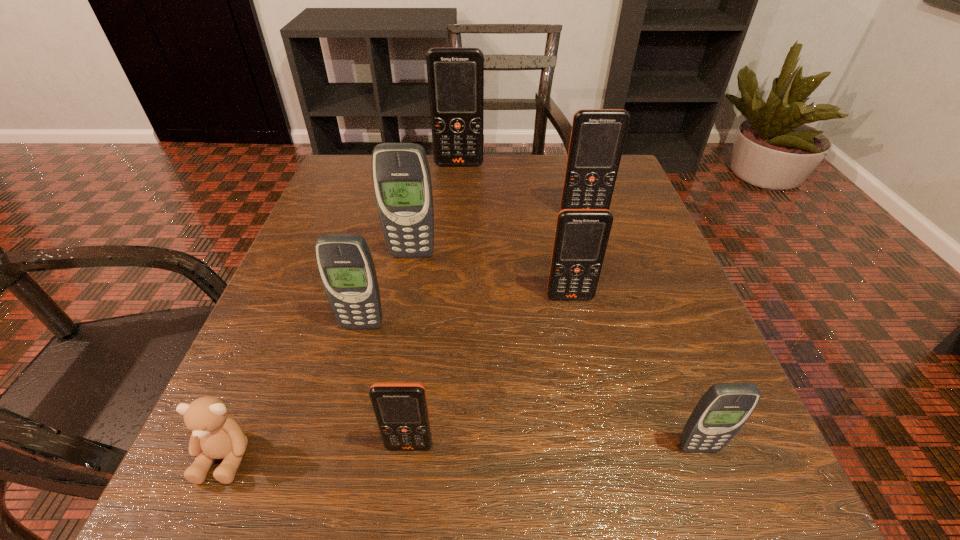
Find the location of `empty location between the farthest cellular telephone and the nearest gray cellular telephone`. empty location between the farthest cellular telephone and the nearest gray cellular telephone is located at coordinates (579, 306).

The image size is (960, 540). Find the location of `empty location between the second biggest gray cellular telephone and the nearest gray cellular telephone`. empty location between the second biggest gray cellular telephone and the nearest gray cellular telephone is located at coordinates (530, 387).

Find the location of a particular element. free space between the rightmost gray cellular telephone and the second biggest gray cellular telephone is located at coordinates (530, 387).

Where is `vacant area that lies between the sixth nearest cellular telephone and the smallest gray cellular telephone`? This screenshot has width=960, height=540. vacant area that lies between the sixth nearest cellular telephone and the smallest gray cellular telephone is located at coordinates (641, 330).

Where is `empty space that is in between the second farthest cellular telephone and the smallest gray cellular telephone`? Image resolution: width=960 pixels, height=540 pixels. empty space that is in between the second farthest cellular telephone and the smallest gray cellular telephone is located at coordinates (641, 330).

Identify the location of free space between the second biggest gray cellular telephone and the sixth nearest cellular telephone. (473, 269).

Where is `empty space between the biggest gray cellular telephone and the leftmost object`? The height and width of the screenshot is (540, 960). empty space between the biggest gray cellular telephone and the leftmost object is located at coordinates (319, 355).

You are a GUI agent. You are given a task and a screenshot of the screen. Output one action in this format:
    pyautogui.click(x=<x>, y=<y>)
    Task: Click on the empty space that is in between the fourth nearest cellular telephone and the nearest orange cellular telephone
    Image resolution: width=960 pixels, height=540 pixels.
    Given the screenshot: What is the action you would take?
    pyautogui.click(x=490, y=372)

Identify which object is the seventh nearest to the third nearest cellular telephone. Please provide its 2D coordinates. Your answer should be formatted as a tuple, i.e. [(x, y)], where the tuple contains the x and y coordinates of a point satisfying the conditions above.

[(455, 75)]

Locate which object is the closest to the farthest cellular telephone. Please provide its 2D coordinates. Your answer should be formatted as a tuple, i.e. [(x, y)], where the tuple contains the x and y coordinates of a point satisfying the conditions above.

[(597, 139)]